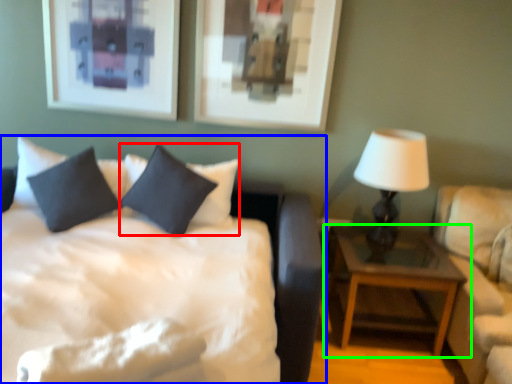
Question: Considering the real-world distances, which object is farthest from pillow (highlighted by a red box)? bed (highlighted by a blue box) or nightstand (highlighted by a green box)?

Choices:
 (A) bed
 (B) nightstand

Answer: (B)